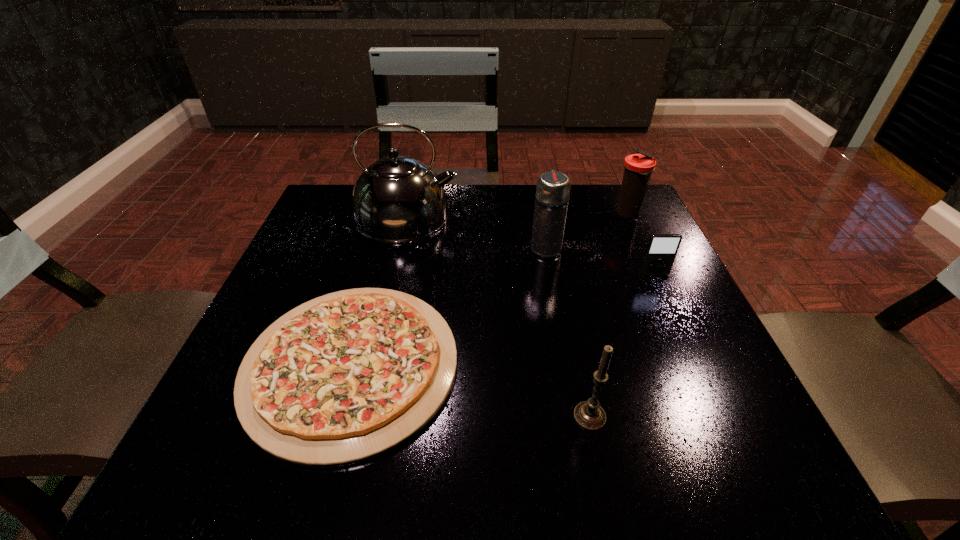
Find the location of a particular element. thermos bottle located at the right edge is located at coordinates (638, 168).

Identify the location of iPod that is at the right edge. (661, 250).

At what (x,y) coordinates should I click in order to perform the action: click on object that is at the far left corner. Please return your answer as a coordinate pair (x, y). The width and height of the screenshot is (960, 540). Looking at the image, I should click on (397, 199).

Where is `object present at the near left corner`? The width and height of the screenshot is (960, 540). object present at the near left corner is located at coordinates (348, 376).

The width and height of the screenshot is (960, 540). Identify the location of object positioned at the far right corner. point(638,168).

Identify the location of vacant region at the far edge of the desktop. This screenshot has width=960, height=540. (465, 208).

Locate an element on the screen. This screenshot has width=960, height=540. blank space at the near edge is located at coordinates (632, 453).

The width and height of the screenshot is (960, 540). In the image, there is a desktop. Identify the location of vacant space at the left edge. (278, 290).

The height and width of the screenshot is (540, 960). Find the location of `vacant region at the right edge of the desktop`. vacant region at the right edge of the desktop is located at coordinates (721, 372).

At what (x,y) coordinates should I click in order to perform the action: click on free space at the far right corner. Please return your answer as a coordinate pair (x, y). This screenshot has height=540, width=960. Looking at the image, I should click on (609, 230).